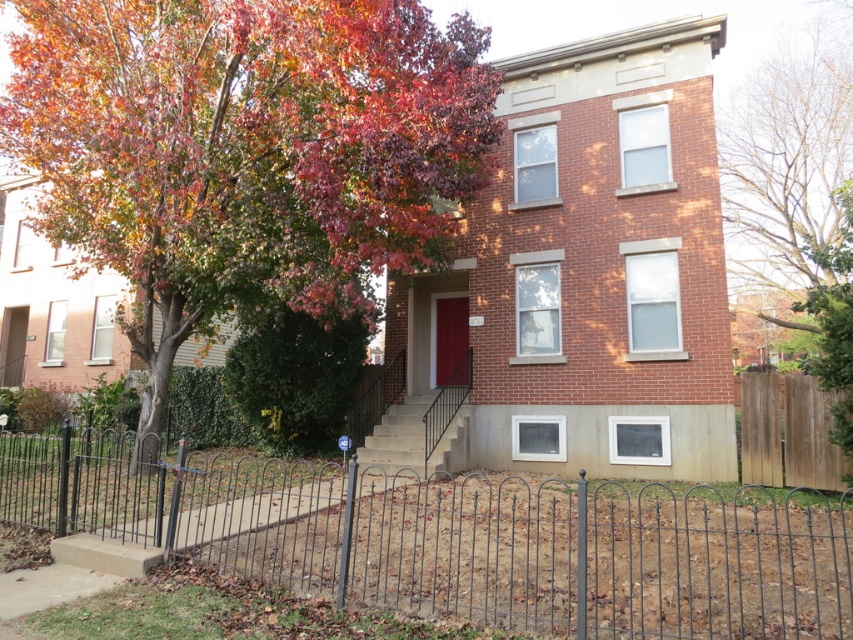
Is autumn leaves at center bigger than black wrought iron fence at center?

No.

Who is taller, autumn leaves at center or black wrought iron fence at center?

black wrought iron fence at center

Who is more forward, [125,8] or [776,554]?

Positioned in front is point [776,554].

At what (x,y) coordinates should I click in order to perform the action: click on autumn leaves at center. Please return your answer as a coordinate pair (x, y). The image size is (853, 640). Looking at the image, I should click on (245, 148).

Is point (775, 600) closer to viewer compared to point (811, 216)?

Yes, point (775, 600) is in front of point (811, 216).

You are a GUI agent. You are given a task and a screenshot of the screen. Output one action in this format:
    pyautogui.click(x=<x>, y=<y>)
    Task: Click on the black wrought iron fence at center
    Image resolution: width=853 pixels, height=640 pixels.
    Given the screenshot: What is the action you would take?
    pyautogui.click(x=463, y=538)

Which is in front, point (224, 452) or point (759, 198)?

Point (224, 452) is more forward.

The image size is (853, 640). I want to click on black wrought iron fence at center, so click(x=463, y=538).

Is autumn leaves at center positioned behind bare wood fence at right?

No, autumn leaves at center is closer to the viewer.

Does autumn leaves at center have a smaller size compared to bare wood fence at right?

Indeed, autumn leaves at center has a smaller size compared to bare wood fence at right.

Which is in front, point (26, 26) or point (785, 221)?

Positioned in front is point (26, 26).

This screenshot has height=640, width=853. In order to click on autumn leaves at center in this screenshot , I will do `click(245, 148)`.